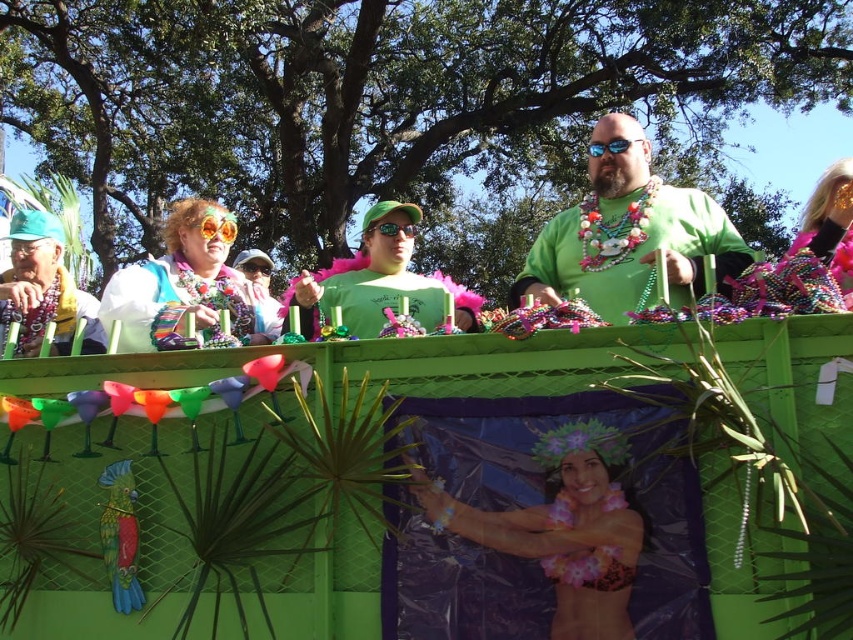
You are standing at the camera position and want to throw a water balloon to the person wearing the green matte shirt at center. If the water balloon has a range of 18 meters, will it reach them?

The distance between the green matte shirt at center and the camera is 17.60 meters. Since the water balloon has a range of 18 meters, it will successfully reach the person wearing the green matte shirt at center.

You are a photographer standing at the center of the scene. You want to take a photo of the green matte shirt at center. Where should you aim your camera to capture it?

You should aim your camera at point coordinates of 0.366 on the x axis and 0.736 on the y axis to capture the green matte shirt at center.

You are a photographer trying to capture a shot of the floral bikini at center and the white fabric with colorful beads at left. From which side of the float should you position yourself to ensure both objects are visible in the frame?

You should position yourself to the right side of the float so that both the floral bikini at center and the white fabric with colorful beads at left are visible in the frame, as the floral bikini at center is to the right of the white fabric with colorful beads at left.